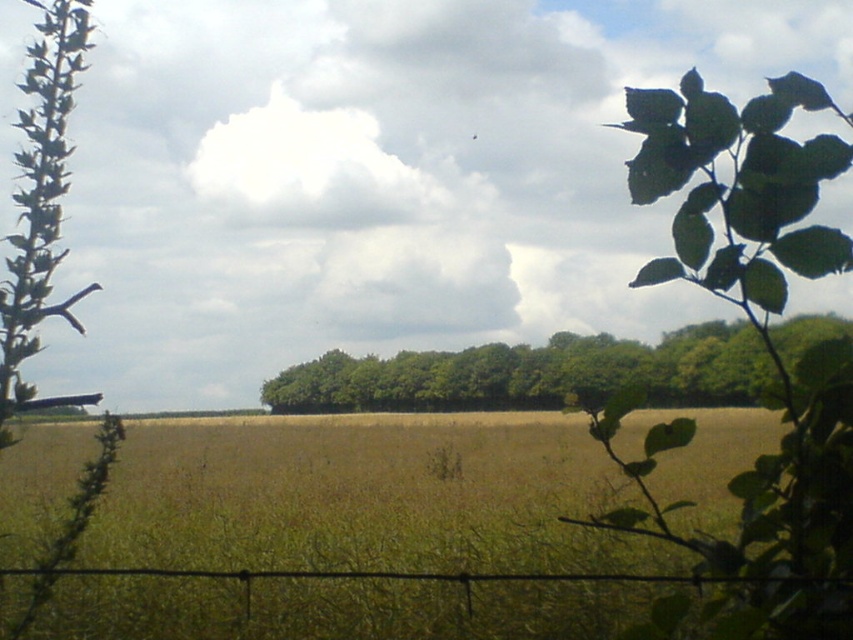
Question: Is green leafy trees at center wider than green fuzzy plant at lower left?

Choices:
 (A) no
 (B) yes

Answer: (B)

Question: Which point is farther from the camera taking this photo?

Choices:
 (A) (320, 362)
 (B) (93, 483)

Answer: (A)

Question: In this image, where is green leafy trees at center located relative to black wire fence at lower center?

Choices:
 (A) right
 (B) left

Answer: (A)

Question: Estimate the real-world distances between objects in this image. Which object is closer to the green leafy trees at center?

Choices:
 (A) green fuzzy plant at lower left
 (B) black wire fence at lower center

Answer: (B)

Question: Which is farther from the black wire fence at lower center?

Choices:
 (A) green fuzzy plant at lower left
 (B) green leafy trees at center

Answer: (B)

Question: Where is green leafy trees at center located in relation to black wire fence at lower center in the image?

Choices:
 (A) left
 (B) right

Answer: (B)